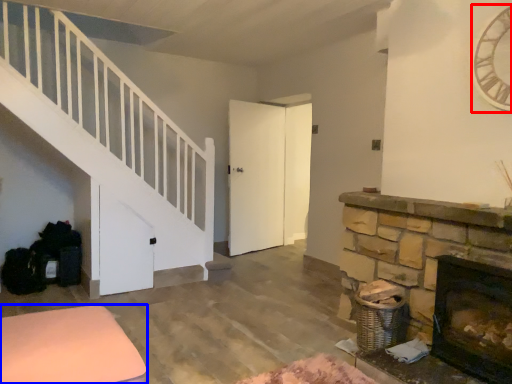
Question: Which object appears closest to the camera in this image, clock (highlighted by a red box) or furniture (highlighted by a blue box)?

Choices:
 (A) clock
 (B) furniture

Answer: (B)